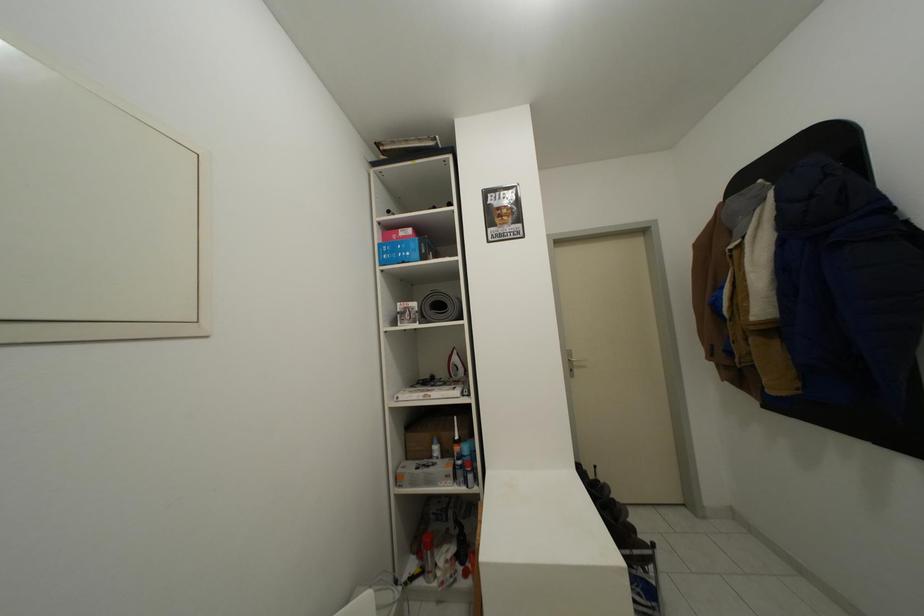
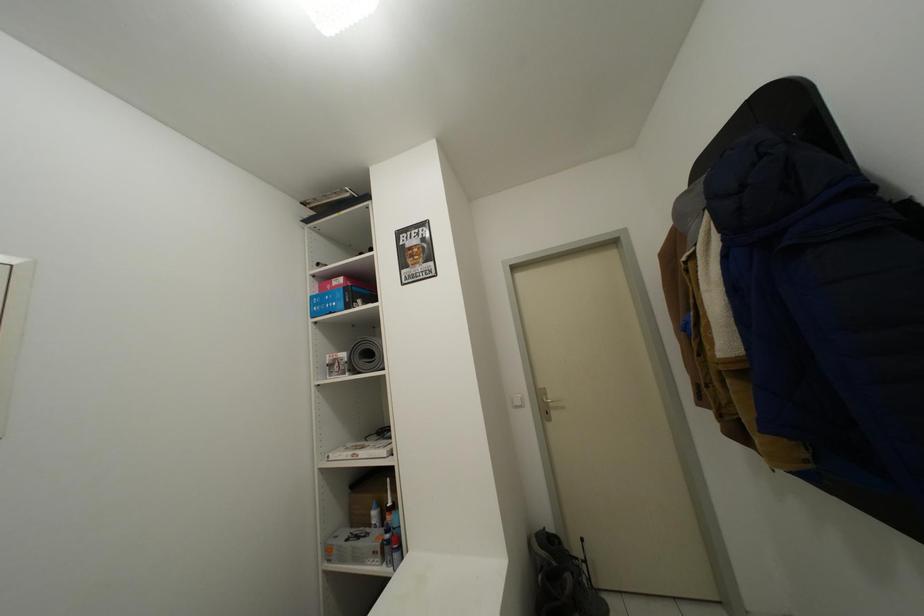
Question: Which direction would the cameraman need to move to produce the second image? Reply with the corresponding letter.

Choices:
 (A) Left
 (B) Right
 (C) Forward
 (D) Backward

Answer: (B)